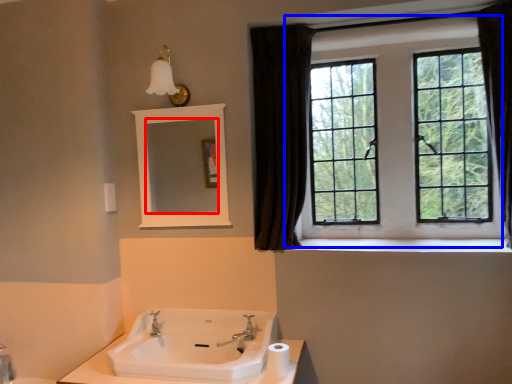
Question: Which object appears closest to the camera in this image, mirror (highlighted by a red box) or window (highlighted by a blue box)?

Choices:
 (A) mirror
 (B) window

Answer: (B)